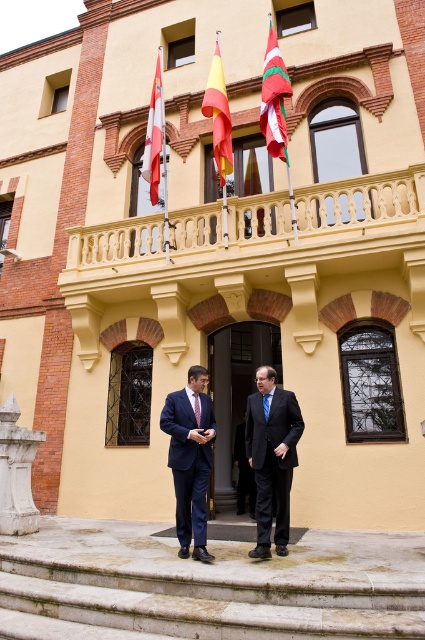
You are a photographer positioned at the base of the steps. You want to take a photo that includes both the dark blue suit at center and the white and red striped flag at upper center. Which object will appear larger in the photo?

The dark blue suit at center will appear larger in the photo because it is closer to the viewer than the white and red striped flag at upper center.